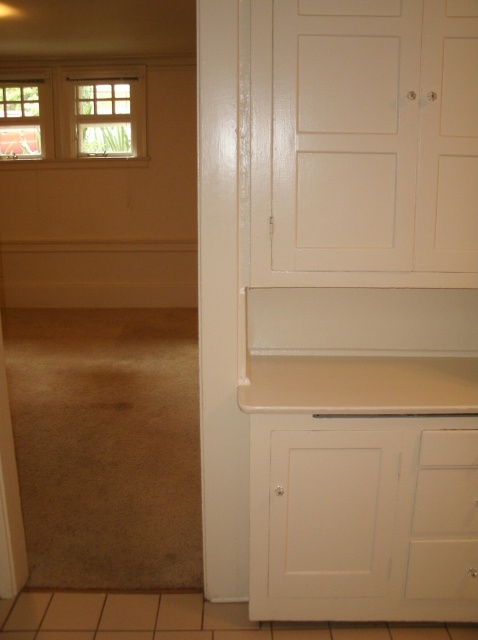
You are standing in the room and want to determine the relative positions of two points marked in the image. Which point is closer to you, the point at coordinates point (74, 104) or point (119, 81)?

The point at coordinates point (74, 104) is closer to you because it is further to the viewer than point (119, 81).

From the picture: You are standing in the room with the built in cabinet and want to look outside through the windows. Which window, the wooden window at upper left or the clear glass window at upper left, would allow you to see outside more clearly?

The clear glass window at upper left would allow you to see outside more clearly since it is made of clear glass, unlike the wooden window at upper left which is likely obstructed by wood.

You are standing in the room with the built in cabinet and want to look through the windows to see outside. Which window, the matte glass window at upper left or the clear glass window at upper left, would allow you to see more clearly?

The clear glass window at upper left allows for clearer visibility since it is behind the matte glass window at upper left and not obstructed by its surface.